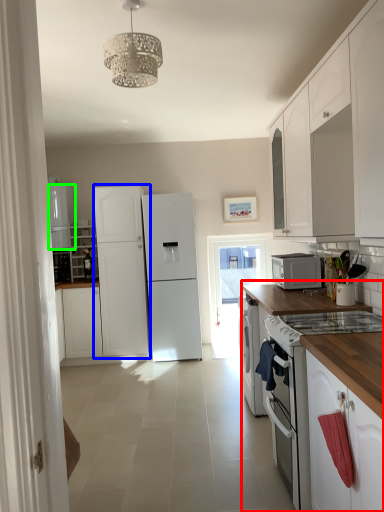
Question: Which object is the closest to the countertop (highlighted by a red box)? Choose among these: refrigerator (highlighted by a blue box) or refrigerator (highlighted by a green box).

Choices:
 (A) refrigerator
 (B) refrigerator

Answer: (A)